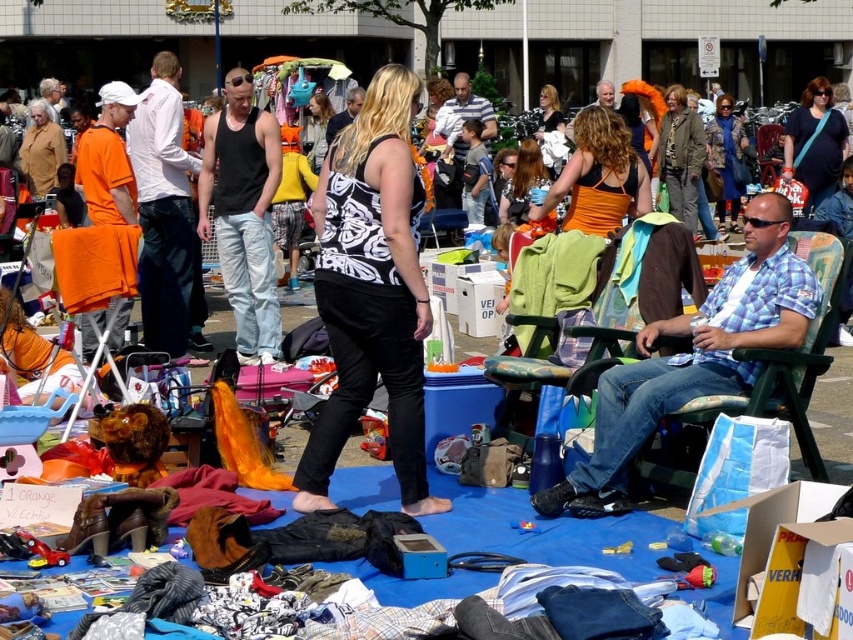
Question: Which of these objects is positioned farthest from the black matte tank top at center?

Choices:
 (A) blue plaid shirt at center
 (B) black tank top at center
 (C) green fabric chair at right

Answer: (B)

Question: Is black matte tank top at center positioned behind green fabric chair at right?

Choices:
 (A) no
 (B) yes

Answer: (A)

Question: Is black matte tank top at center wider than black tank top at center?

Choices:
 (A) no
 (B) yes

Answer: (A)

Question: Is blue plaid shirt at center wider than black tank top at center?

Choices:
 (A) yes
 (B) no

Answer: (A)

Question: Which of the following is the farthest from the observer?

Choices:
 (A) (519, 410)
 (B) (219, 252)
 (C) (590, 496)
 (D) (312, 436)

Answer: (B)

Question: Among these points, which one is nearest to the camera?

Choices:
 (A) (271, 332)
 (B) (372, 97)
 (C) (656, 250)
 (D) (601, 381)

Answer: (B)